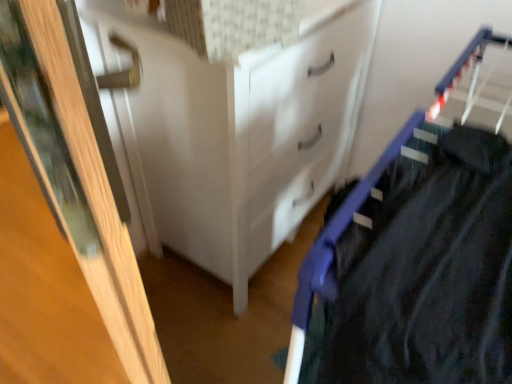
Describe the element at coordinates (75, 176) in the screenshot. I see `wooden door at left` at that location.

You are a GUI agent. You are given a task and a screenshot of the screen. Output one action in this format:
    pyautogui.click(x=<x>, y=<y>)
    Task: Click on the wooden door at left
    
    Given the screenshot: What is the action you would take?
    pyautogui.click(x=75, y=176)

The image size is (512, 384). What do you see at coordinates (236, 135) in the screenshot?
I see `white glossy chest of drawers at center` at bounding box center [236, 135].

This screenshot has width=512, height=384. I want to click on white glossy chest of drawers at center, so click(236, 135).

Identify the location of wooden door at left. (75, 176).

Between wooden door at left and white glossy chest of drawers at center, which one appears on the right side from the viewer's perspective?

From the viewer's perspective, white glossy chest of drawers at center appears more on the right side.

Between wooden door at left and white glossy chest of drawers at center, which one is positioned behind?

Positioned behind is white glossy chest of drawers at center.

Is point (71, 211) positioned in front of point (255, 52)?

That is True.

From the image's perspective, which object appears higher, wooden door at left or white glossy chest of drawers at center?

white glossy chest of drawers at center appears higher in the image.

From the picture: From a real-world perspective, is wooden door at left over white glossy chest of drawers at center?

Yes, from a real-world perspective, wooden door at left is above white glossy chest of drawers at center.

Considering the relative sizes of wooden door at left and white glossy chest of drawers at center in the image provided, is wooden door at left thinner than white glossy chest of drawers at center?

Yes, wooden door at left is thinner than white glossy chest of drawers at center.

Which of these two, wooden door at left or white glossy chest of drawers at center, stands shorter?

With less height is white glossy chest of drawers at center.

Considering the sizes of objects wooden door at left and white glossy chest of drawers at center in the image provided, who is bigger, wooden door at left or white glossy chest of drawers at center?

white glossy chest of drawers at center is bigger.

Is wooden door at left outside of white glossy chest of drawers at center?

That's correct, wooden door at left is outside of white glossy chest of drawers at center.

Is wooden door at left positioned far away from white glossy chest of drawers at center?

No, wooden door at left is in close proximity to white glossy chest of drawers at center.

Is white glossy chest of drawers at center at the back of wooden door at left?

Correct, wooden door at left is looking away from white glossy chest of drawers at center.

Measure the distance between wooden door at left and white glossy chest of drawers at center.

They are 31.85 inches apart.

Locate an element on the screen. the chest of drawers behind the wooden door at left is located at coordinates pos(236,135).

Is white glossy chest of drawers at center to the left of wooden door at left from the viewer's perspective?

In fact, white glossy chest of drawers at center is to the right of wooden door at left.

Looking at this image, does white glossy chest of drawers at center come behind wooden door at left?

Yes, white glossy chest of drawers at center is further from the camera.

Between point (170, 181) and point (68, 4), which one is positioned in front?

Positioned in front is point (68, 4).

From the image's perspective, which object appears higher, white glossy chest of drawers at center or wooden door at left?

white glossy chest of drawers at center, from the image's perspective.

From a real-world perspective, which is physically above, white glossy chest of drawers at center or wooden door at left?

wooden door at left, from a real-world perspective.

Considering the relative sizes of white glossy chest of drawers at center and wooden door at left in the image provided, is white glossy chest of drawers at center thinner than wooden door at left?

In fact, white glossy chest of drawers at center might be wider than wooden door at left.

Is white glossy chest of drawers at center shorter than wooden door at left?

Yes.

Can you confirm if white glossy chest of drawers at center is bigger than wooden door at left?

Indeed, white glossy chest of drawers at center has a larger size compared to wooden door at left.

Is wooden door at left completely or partially inside white glossy chest of drawers at center?

No, wooden door at left is located outside of white glossy chest of drawers at center.

In the scene shown: Is white glossy chest of drawers at center with wooden door at left?

white glossy chest of drawers at center is not next to wooden door at left, and they're not touching.

Is white glossy chest of drawers at center facing away from wooden door at left?

No, wooden door at left is not at the back of white glossy chest of drawers at center.

How different are the orientations of white glossy chest of drawers at center and wooden door at left in degrees?

There is a 123-degree angle between the facing directions of white glossy chest of drawers at center and wooden door at left.

In the image, there is a wooden door at left. Where is `the chest of drawers below it (from a real-world perspective)`? the chest of drawers below it (from a real-world perspective) is located at coordinates (236, 135).

This screenshot has height=384, width=512. Find the location of `door in front of the white glossy chest of drawers at center`. door in front of the white glossy chest of drawers at center is located at coordinates (x=75, y=176).

Locate an element on the screen. chest of drawers behind the wooden door at left is located at coordinates (236, 135).